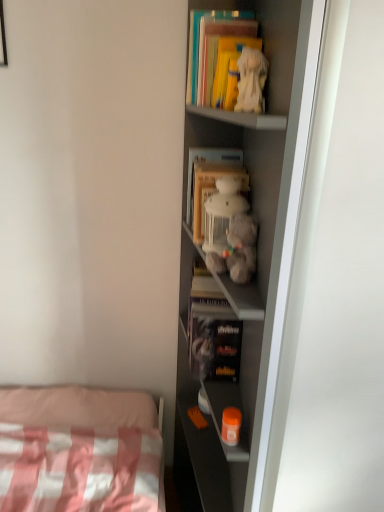
Question: Does matte yellow book at upper center, which appears as the fourth book when ordered from the bottom, have a lesser width compared to matte gray shelf at center?

Choices:
 (A) yes
 (B) no

Answer: (A)

Question: From the image's perspective, is matte yellow book at upper center, arranged as the first book when viewed from the top, located above matte gray shelf at center?

Choices:
 (A) no
 (B) yes

Answer: (B)

Question: Is matte yellow book at upper center, which appears as the fourth book when ordered from the bottom, wider than matte gray shelf at center?

Choices:
 (A) no
 (B) yes

Answer: (A)

Question: Can you confirm if matte yellow book at upper center, which appears as the fourth book when ordered from the bottom, is shorter than matte gray shelf at center?

Choices:
 (A) no
 (B) yes

Answer: (B)

Question: Is matte yellow book at upper center, which appears as the fourth book when ordered from the bottom, behind matte gray shelf at center?

Choices:
 (A) yes
 (B) no

Answer: (A)

Question: From the image's perspective, is hardcover book at center, the first book when ordered from bottom to top, located above or below fluffy gray stuffed animal at center, which is counted as the third toy, starting from the top?

Choices:
 (A) below
 (B) above

Answer: (A)

Question: Considering the relative positions of hardcover book at center, the first book when ordered from bottom to top, and fluffy gray stuffed animal at center, arranged as the 2th toy when ordered from the bottom, in the image provided, is hardcover book at center, the first book when ordered from bottom to top, to the left or to the right of fluffy gray stuffed animal at center, arranged as the 2th toy when ordered from the bottom,?

Choices:
 (A) right
 (B) left

Answer: (B)

Question: From a real-world perspective, is hardcover book at center, the first book when ordered from bottom to top, physically located above or below fluffy gray stuffed animal at center, arranged as the 2th toy when ordered from the bottom?

Choices:
 (A) below
 (B) above

Answer: (A)

Question: In terms of height, does hardcover book at center, arranged as the 4th book when viewed from the top, look taller or shorter compared to fluffy gray stuffed animal at center, which is counted as the third toy, starting from the top?

Choices:
 (A) short
 (B) tall

Answer: (B)

Question: Is matte yellow book at upper center, arranged as the first book when viewed from the top, in front of or behind fluffy gray stuffed animal at center, arranged as the 2th toy when ordered from the bottom, in the image?

Choices:
 (A) front
 (B) behind

Answer: (B)

Question: Is matte yellow book at upper center, arranged as the first book when viewed from the top, bigger or smaller than fluffy gray stuffed animal at center, arranged as the 2th toy when ordered from the bottom?

Choices:
 (A) small
 (B) big

Answer: (A)

Question: Does point (205, 48) appear closer or farther from the camera than point (244, 215)?

Choices:
 (A) closer
 (B) farther

Answer: (A)

Question: Considering the positions of matte yellow book at upper center, arranged as the first book when viewed from the top, and fluffy gray stuffed animal at center, which is counted as the third toy, starting from the top, in the image, is matte yellow book at upper center, arranged as the first book when viewed from the top, wider or thinner than fluffy gray stuffed animal at center, which is counted as the third toy, starting from the top,?

Choices:
 (A) wide
 (B) thin

Answer: (A)

Question: Looking at the image, does matte gray shelf at center seem bigger or smaller compared to fluffy white teddy bear at center, which is the third toy in bottom-to-top order?

Choices:
 (A) small
 (B) big

Answer: (B)

Question: From a real-world perspective, is matte gray shelf at center positioned above or below fluffy white teddy bear at center, which is the third toy in bottom-to-top order?

Choices:
 (A) below
 (B) above

Answer: (A)